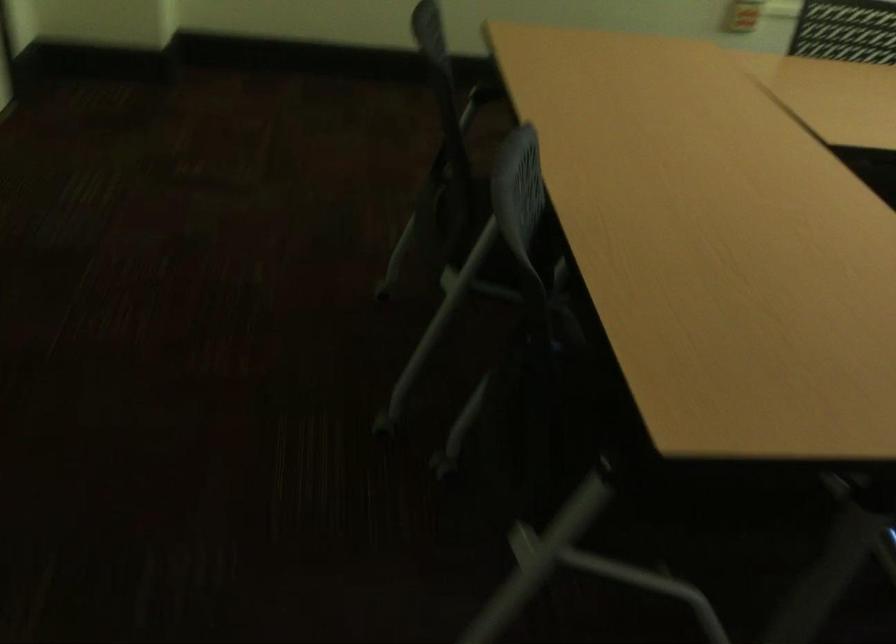
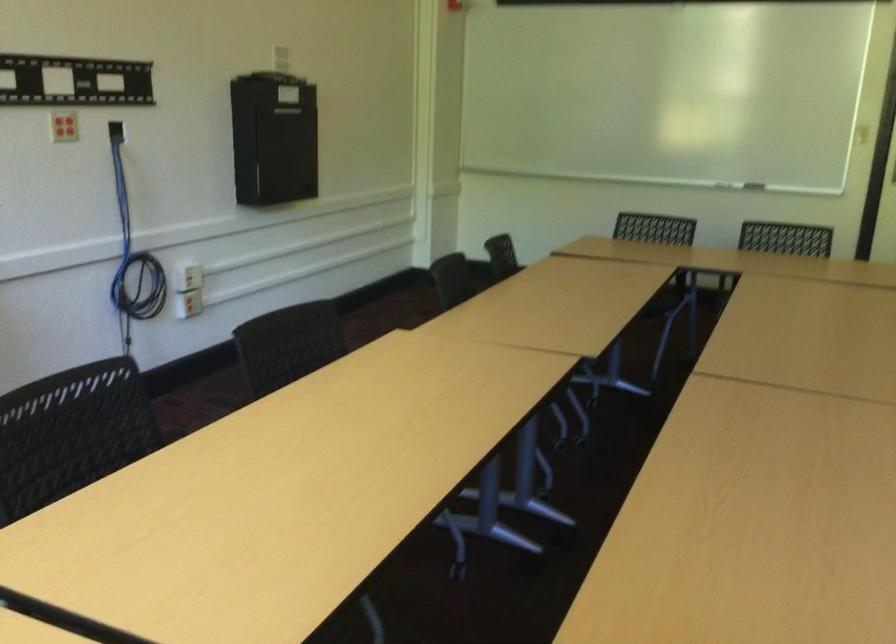
Question: I am providing you with two images of the same scene from different viewpoints. Which of the following objects are not visible in image2?

Choices:
 (A) blue coiled cable
 (B) dark chair sitting surface
 (C) black box door
 (D) white computer mouse

Answer: (B)